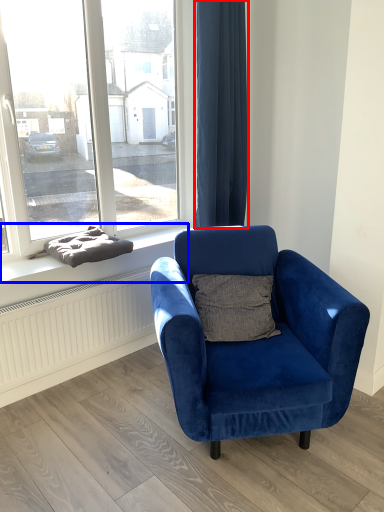
Question: Among these objects, which one is nearest to the camera, curtain (highlighted by a red box) or window sill (highlighted by a blue box)?

Choices:
 (A) curtain
 (B) window sill

Answer: (B)